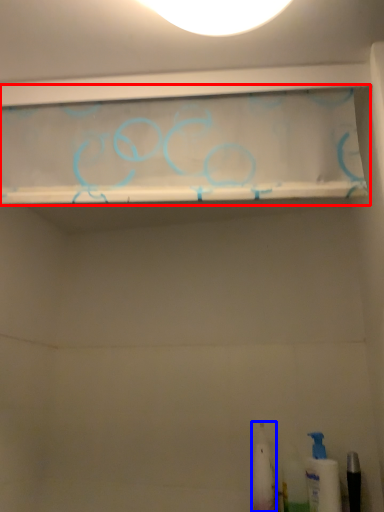
Question: Which of the following is the closest to the observer, shelf (highlighted by a red box) or toiletry (highlighted by a blue box)?

Choices:
 (A) shelf
 (B) toiletry

Answer: (A)